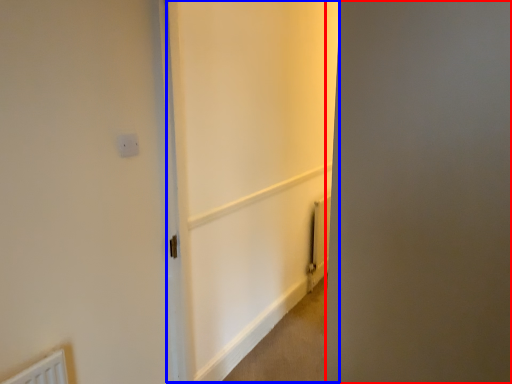
Question: Which object is further to the camera taking this photo, screen door (highlighted by a red box) or screen door (highlighted by a blue box)?

Choices:
 (A) screen door
 (B) screen door

Answer: (B)